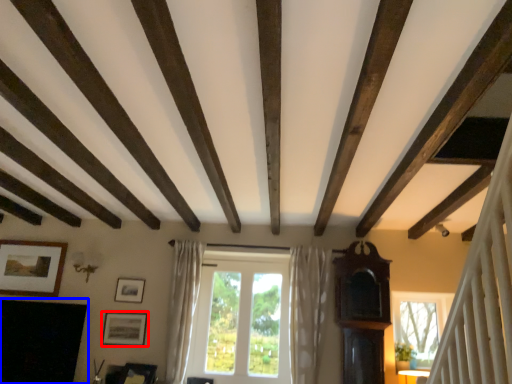
Question: Which of the following is the closest to the observer, picture frame (highlighted by a red box) or fireplace (highlighted by a blue box)?

Choices:
 (A) picture frame
 (B) fireplace

Answer: (B)